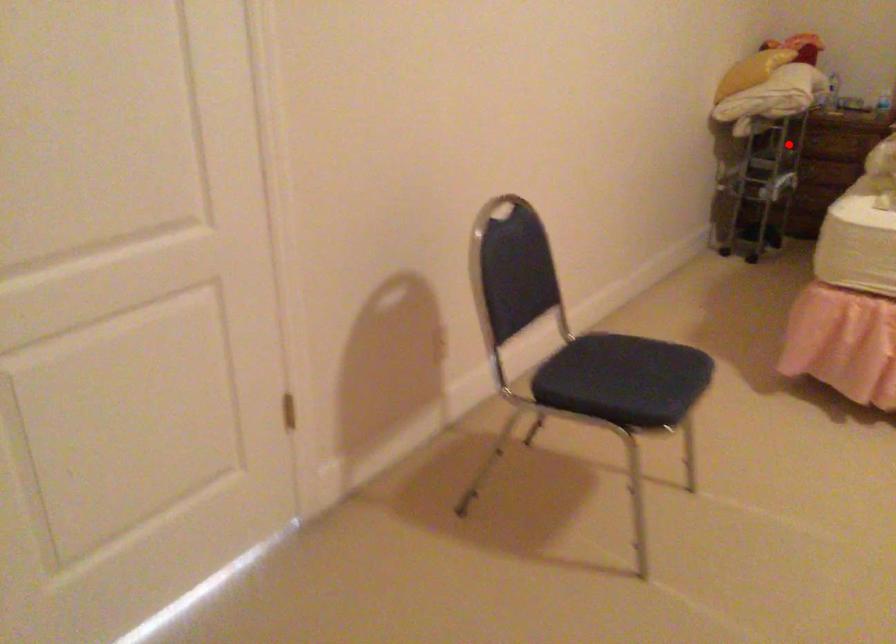
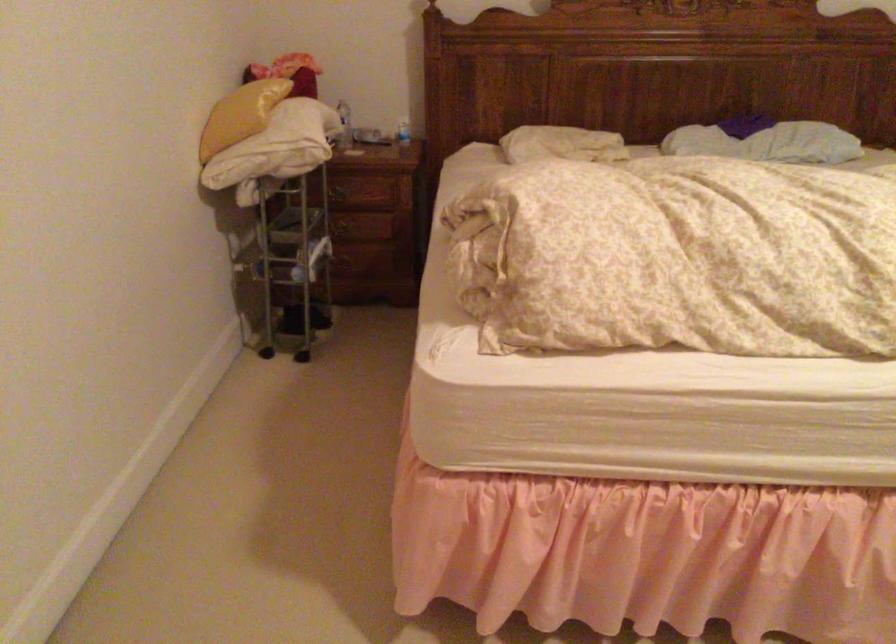
Question: A red point is marked in image1. In image2, is the corresponding 3D point closer to the camera or farther? Reply with the corresponding letter.

Choices:
 (A) The corresponding 3D point is closer.
 (B) The corresponding 3D point is farther.

Answer: (A)